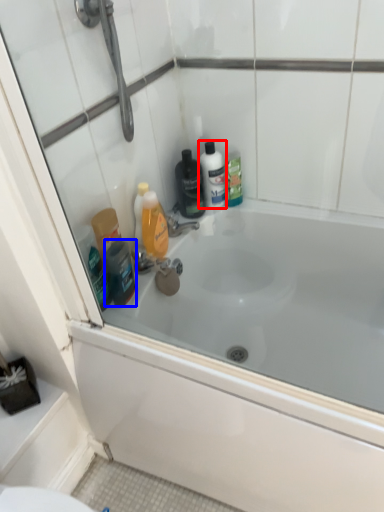
Question: Among these objects, which one is farthest to the camera, mouthwash (highlighted by a red box) or toiletry (highlighted by a blue box)?

Choices:
 (A) mouthwash
 (B) toiletry

Answer: (A)